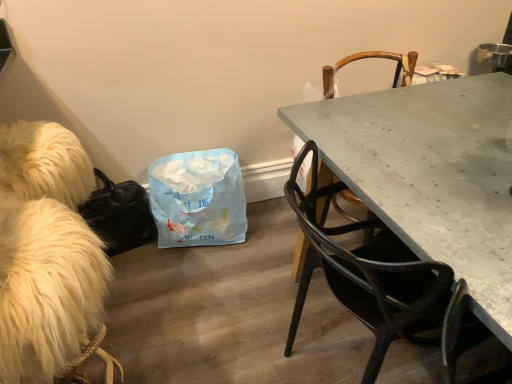
Question: Is white fluffy dog at left looking in the opposite direction of metallic gray chair at right, the second chair when ordered from front to back?

Choices:
 (A) yes
 (B) no

Answer: (A)

Question: From the image's perspective, is white fluffy dog at left on top of metallic gray chair at right, which appears as the 1th chair when viewed from the back?

Choices:
 (A) no
 (B) yes

Answer: (A)

Question: Is white fluffy dog at left positioned in front of metallic gray chair at right, the second chair when ordered from front to back?

Choices:
 (A) yes
 (B) no

Answer: (A)

Question: Is white fluffy dog at left completely or partially outside of metallic gray chair at right, which appears as the 1th chair when viewed from the back?

Choices:
 (A) yes
 (B) no

Answer: (A)

Question: From the image's perspective, is white fluffy dog at left under metallic gray chair at right, which appears as the 1th chair when viewed from the back?

Choices:
 (A) yes
 (B) no

Answer: (A)

Question: In terms of height, does metallic gray chair at right, the second chair when ordered from front to back, look taller or shorter compared to light blue paper bag at center?

Choices:
 (A) short
 (B) tall

Answer: (B)

Question: Is metallic gray chair at right, which appears as the 1th chair when viewed from the back, bigger or smaller than light blue paper bag at center?

Choices:
 (A) big
 (B) small

Answer: (A)

Question: In terms of width, does metallic gray chair at right, which appears as the 1th chair when viewed from the back, look wider or thinner when compared to light blue paper bag at center?

Choices:
 (A) thin
 (B) wide

Answer: (B)

Question: Based on their positions, is metallic gray chair at right, which appears as the 1th chair when viewed from the back, located to the left or right of light blue paper bag at center?

Choices:
 (A) right
 (B) left

Answer: (A)

Question: Considering the positions of metallic gray chair at right, the second chair when ordered from front to back, and white fluffy dog at left in the image, is metallic gray chair at right, the second chair when ordered from front to back, bigger or smaller than white fluffy dog at left?

Choices:
 (A) small
 (B) big

Answer: (B)

Question: In the image, is metallic gray chair at right, the second chair when ordered from front to back, positioned in front of or behind white fluffy dog at left?

Choices:
 (A) behind
 (B) front

Answer: (A)

Question: From a real-world perspective, is metallic gray chair at right, which appears as the 1th chair when viewed from the back, positioned above or below white fluffy dog at left?

Choices:
 (A) below
 (B) above

Answer: (B)

Question: Considering the positions of point (399, 74) and point (16, 246), is point (399, 74) closer or farther from the camera than point (16, 246)?

Choices:
 (A) farther
 (B) closer

Answer: (A)

Question: In the image, is metallic gray chair at right, which appears as the 1th chair when viewed from the back, positioned in front of or behind matte black chair at right, the 1th chair viewed from the front?

Choices:
 (A) front
 (B) behind

Answer: (B)

Question: Is metallic gray chair at right, which appears as the 1th chair when viewed from the back, taller or shorter than matte black chair at right, the 1th chair viewed from the front?

Choices:
 (A) short
 (B) tall

Answer: (B)